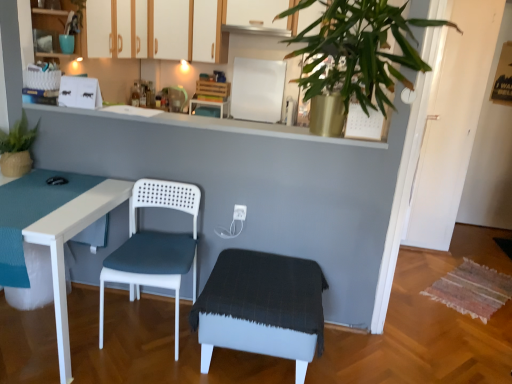
Locate an element on the screen. unoccupied region to the right of white fabric step stool at center is located at coordinates (362, 359).